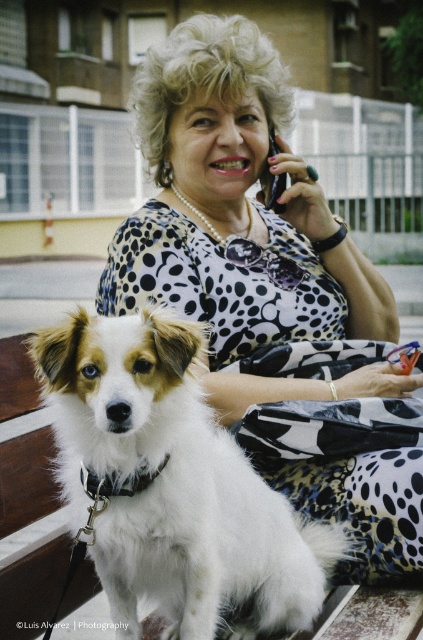
Which is above, floral-patterned blouse at center or white fluffy dog at center?

floral-patterned blouse at center is higher up.

This screenshot has width=423, height=640. Describe the element at coordinates (269, 291) in the screenshot. I see `floral-patterned blouse at center` at that location.

Who is more forward, (257, 253) or (329, 525)?

Positioned in front is point (329, 525).

Where is `floral-patterned blouse at center`? This screenshot has height=640, width=423. floral-patterned blouse at center is located at coordinates (269, 291).